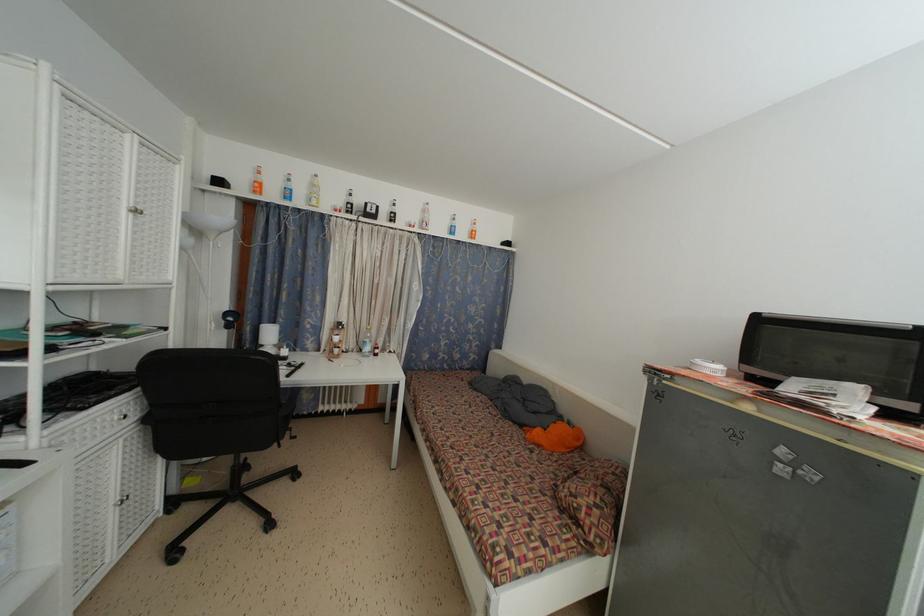
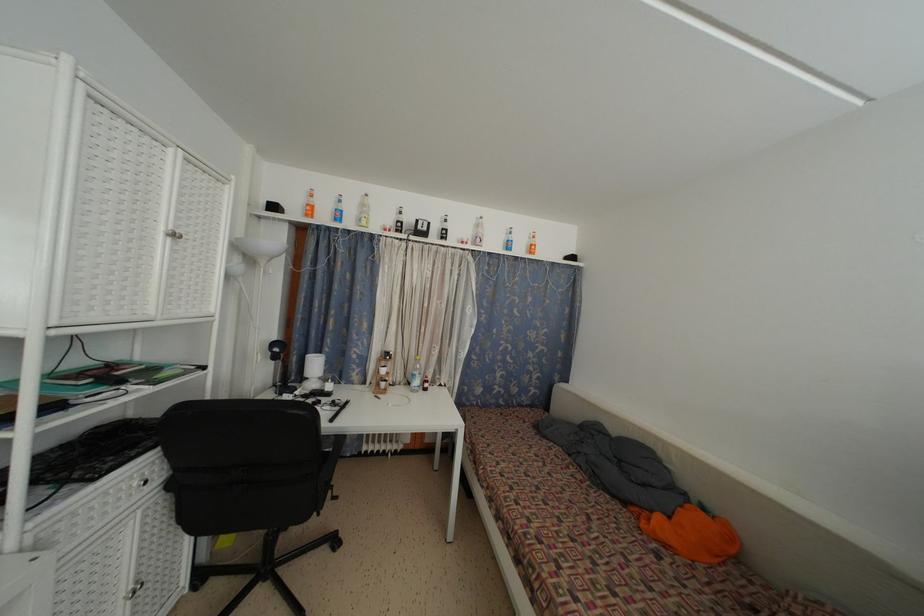
Find the pixel in the second image that matches pixel 117 506 in the first image.

(129, 594)